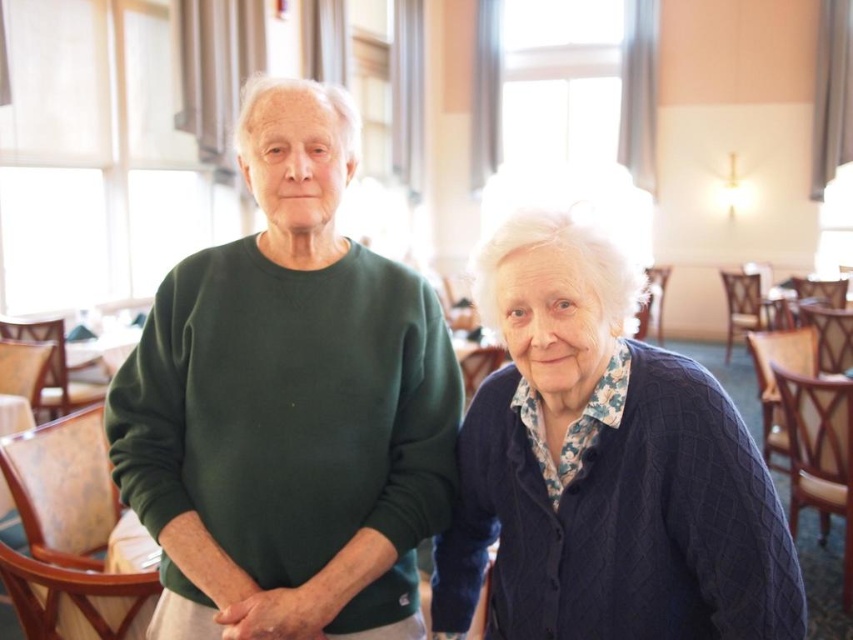
From the picture: You are a photographer setting up for a group photo. You need to ensure that both the green cotton sweater at center and the knitted navy cardigan at right are clearly visible in the frame. Based on their positions, which clothing item might be partially obscured if they move closer to each other?

The knitted navy cardigan at right is behind the green cotton sweater at center, so if they move closer, the knitted navy cardigan at right might be partially obscured by the green cotton sweater at center.

You are an interior designer asked to place a decorative item between the green cotton sweater at center and the knitted navy cardigan at right. Based on their positions, which side of the cardigan should the item be placed?

The green cotton sweater at center is to the left of the knitted navy cardigan at right, so placing the decorative item between them would position it to the left side of the knitted navy cardigan at right.